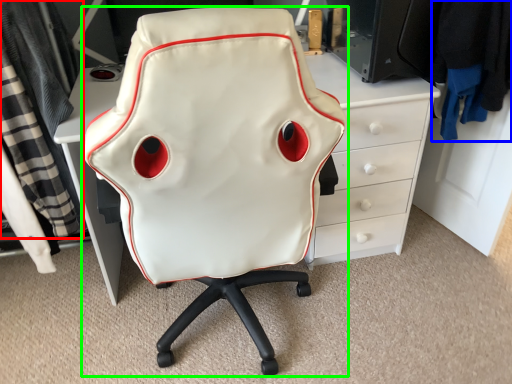
Question: Which object is positioned closest to clothing (highlighted by a red box)? Select from clothing (highlighted by a blue box) and chair (highlighted by a green box).

Choices:
 (A) clothing
 (B) chair

Answer: (B)